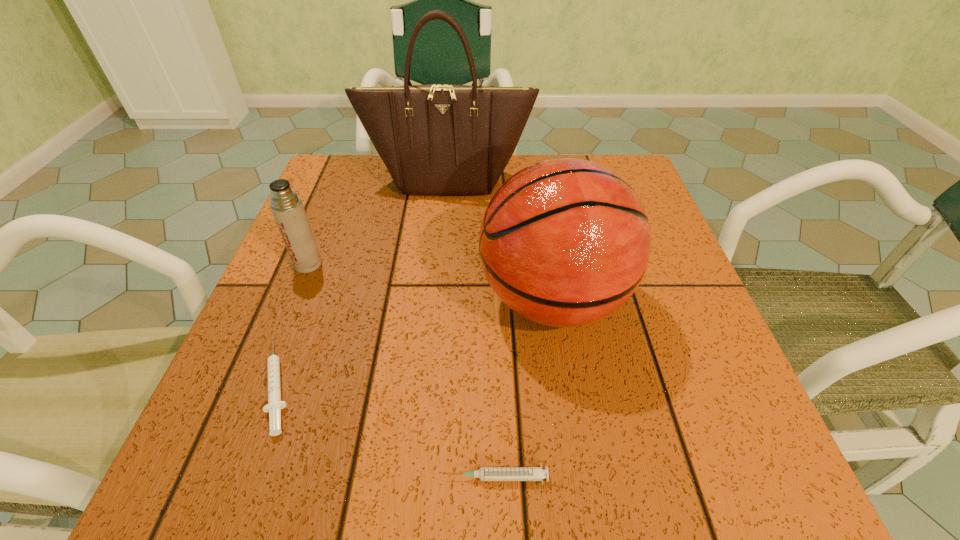
Find the location of a particular element. The width and height of the screenshot is (960, 540). the farthest object is located at coordinates click(x=436, y=139).

You are a GUI agent. You are given a task and a screenshot of the screen. Output one action in this format:
    pyautogui.click(x=<x>, y=<y>)
    Task: Click on the handbag
    This screenshot has height=540, width=960.
    Given the screenshot: What is the action you would take?
    pyautogui.click(x=436, y=139)

At what (x,y) coordinates should I click in order to perform the action: click on basketball. Please return your answer as a coordinate pair (x, y). Image resolution: width=960 pixels, height=540 pixels. Looking at the image, I should click on (564, 242).

Locate an element on the screen. Image resolution: width=960 pixels, height=540 pixels. the third tallest object is located at coordinates point(287,207).

The image size is (960, 540). I want to click on the farther syringe, so click(274, 406).

Identify the location of the nearer syringe. coord(484,473).

Find the location of a particular element. The height and width of the screenshot is (540, 960). the right syringe is located at coordinates (484, 473).

Locate an element on the screen. This screenshot has height=540, width=960. vacant region located on the front-facing side of the handbag is located at coordinates (434, 326).

Where is `free location located on the side with spill of the basketball`? free location located on the side with spill of the basketball is located at coordinates (440, 300).

Locate an element on the screen. The width and height of the screenshot is (960, 540). vacant position located on the side with spill of the basketball is located at coordinates (434, 300).